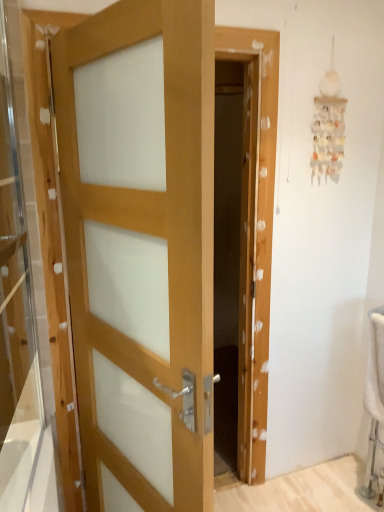
Question: From the image's perspective, is transparent glass door at left located above light wood door at center?

Choices:
 (A) no
 (B) yes

Answer: (B)

Question: Does transparent glass door at left come behind light wood door at center?

Choices:
 (A) yes
 (B) no

Answer: (B)

Question: Is transparent glass door at left facing away from light wood door at center?

Choices:
 (A) no
 (B) yes

Answer: (B)

Question: Is transparent glass door at left positioned beyond the bounds of light wood door at center?

Choices:
 (A) no
 (B) yes

Answer: (B)

Question: From a real-world perspective, is transparent glass door at left physically below light wood door at center?

Choices:
 (A) yes
 (B) no

Answer: (B)

Question: Can you confirm if transparent glass door at left is smaller than light wood door at center?

Choices:
 (A) yes
 (B) no

Answer: (A)

Question: Does light wood door at center appear on the right side of transparent glass door at left?

Choices:
 (A) no
 (B) yes

Answer: (B)

Question: From the image's perspective, is light wood door at center on transparent glass door at left?

Choices:
 (A) yes
 (B) no

Answer: (B)

Question: Is light wood door at center located outside transparent glass door at left?

Choices:
 (A) no
 (B) yes

Answer: (B)

Question: Considering the relative positions of light wood door at center and transparent glass door at left in the image provided, is light wood door at center to the left of transparent glass door at left from the viewer's perspective?

Choices:
 (A) yes
 (B) no

Answer: (B)

Question: Considering the relative sizes of light wood door at center and transparent glass door at left in the image provided, is light wood door at center thinner than transparent glass door at left?

Choices:
 (A) yes
 (B) no

Answer: (B)

Question: Are light wood door at center and transparent glass door at left far apart?

Choices:
 (A) yes
 (B) no

Answer: (B)

Question: In terms of width, does transparent glass door at left look wider or thinner when compared to light wood door at center?

Choices:
 (A) wide
 (B) thin

Answer: (B)